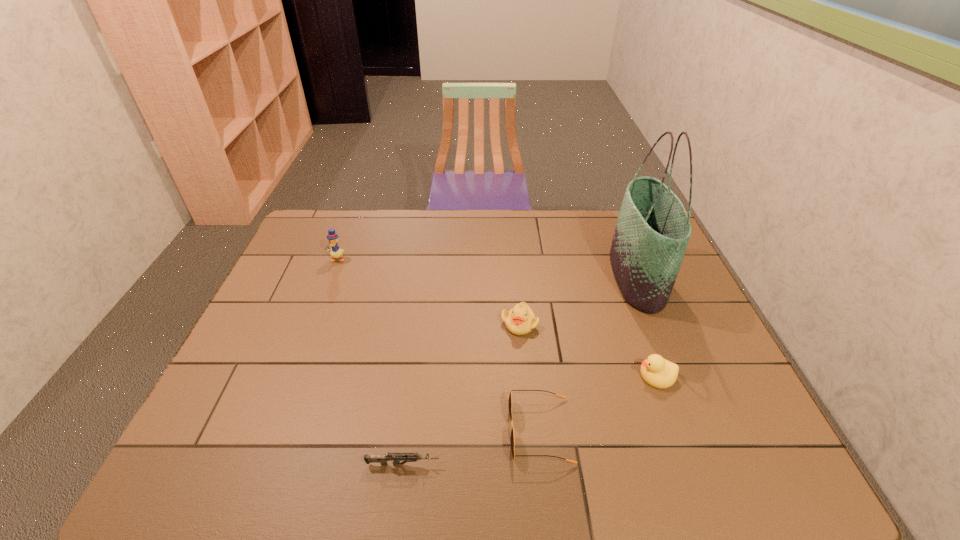
At what (x,y) coordinates should I click in order to perform the action: click on sunglasses that is at the near edge. Please return your answer as a coordinate pair (x, y). This screenshot has width=960, height=540. Looking at the image, I should click on (512, 441).

The width and height of the screenshot is (960, 540). I want to click on gun present at the near edge, so click(x=395, y=457).

In order to click on object that is at the left edge in this screenshot , I will do `click(335, 252)`.

The height and width of the screenshot is (540, 960). I want to click on tote bag at the right edge, so click(652, 232).

You are a GUI agent. You are given a task and a screenshot of the screen. Output one action in this format:
    pyautogui.click(x=<x>, y=<y>)
    Task: Click on the duckling that is at the right edge
    Image resolution: width=960 pixels, height=540 pixels.
    Given the screenshot: What is the action you would take?
    pyautogui.click(x=656, y=371)

Locate an element on the screen. Image resolution: width=960 pixels, height=540 pixels. object situated at the far right corner is located at coordinates [x=652, y=232].

Where is `vacant space at the far edge of the desktop`? This screenshot has height=540, width=960. vacant space at the far edge of the desktop is located at coordinates (417, 210).

Image resolution: width=960 pixels, height=540 pixels. Find the location of `vacant space at the near edge of the desktop`. vacant space at the near edge of the desktop is located at coordinates (359, 468).

The image size is (960, 540). In the image, there is a desktop. Find the location of `free space at the left edge`. free space at the left edge is located at coordinates (308, 296).

Identify the location of free spot at the right edge of the desktop. pos(732,404).